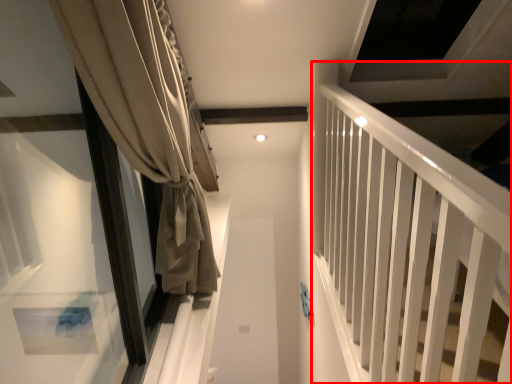
Question: Observing the image, what is the correct spatial positioning of bunk bed (annotated by the red box) in reference to curtain?

Choices:
 (A) left
 (B) right

Answer: (B)